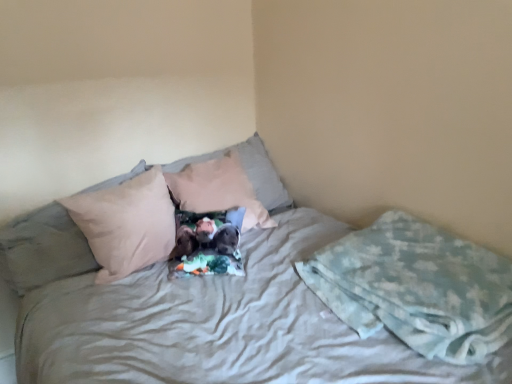
Question: Is beige fabric pillow at left, which appears as the first pillow when viewed from the left, outside of beige fabric pillow at center, which is counted as the second pillow, starting from the left?

Choices:
 (A) yes
 (B) no

Answer: (A)

Question: Could you tell me if beige fabric pillow at left, which appears as the first pillow when viewed from the left, is facing beige fabric pillow at center, which is counted as the second pillow, starting from the left?

Choices:
 (A) yes
 (B) no

Answer: (A)

Question: Is beige fabric pillow at left, which appears as the 3th pillow when viewed from the right, next to beige fabric pillow at center, which is counted as the second pillow, starting from the left?

Choices:
 (A) yes
 (B) no

Answer: (A)

Question: Is beige fabric pillow at left, which appears as the 3th pillow when viewed from the right, at the left side of beige fabric pillow at center, placed as the second pillow when sorted from right to left?

Choices:
 (A) yes
 (B) no

Answer: (A)

Question: Considering the relative sizes of beige fabric pillow at left, which appears as the first pillow when viewed from the left, and beige fabric pillow at center, which is counted as the second pillow, starting from the left, in the image provided, is beige fabric pillow at left, which appears as the first pillow when viewed from the left, taller than beige fabric pillow at center, which is counted as the second pillow, starting from the left,?

Choices:
 (A) yes
 (B) no

Answer: (B)

Question: Is beige fabric pillow at left, which appears as the first pillow when viewed from the left, positioned in front of beige fabric pillow at center, which is counted as the second pillow, starting from the left?

Choices:
 (A) no
 (B) yes

Answer: (A)

Question: From the image's perspective, is light brown fabric pillow at center, acting as the 3th pillow starting from the left, above beige fabric pillow at center, placed as the second pillow when sorted from right to left?

Choices:
 (A) no
 (B) yes

Answer: (B)

Question: Is light brown fabric pillow at center, acting as the 3th pillow starting from the left, behind beige fabric pillow at center, placed as the second pillow when sorted from right to left?

Choices:
 (A) yes
 (B) no

Answer: (A)

Question: Is light brown fabric pillow at center, arranged as the 1th pillow when viewed from the right, turned away from beige fabric pillow at center, which is counted as the second pillow, starting from the left?

Choices:
 (A) no
 (B) yes

Answer: (B)

Question: Considering the relative sizes of light brown fabric pillow at center, arranged as the 1th pillow when viewed from the right, and beige fabric pillow at center, placed as the second pillow when sorted from right to left, in the image provided, is light brown fabric pillow at center, arranged as the 1th pillow when viewed from the right, taller than beige fabric pillow at center, placed as the second pillow when sorted from right to left,?

Choices:
 (A) no
 (B) yes

Answer: (A)

Question: Does light brown fabric pillow at center, arranged as the 1th pillow when viewed from the right, have a lesser width compared to beige fabric pillow at center, which is counted as the second pillow, starting from the left?

Choices:
 (A) yes
 (B) no

Answer: (B)

Question: From the image's perspective, would you say light brown fabric pillow at center, arranged as the 1th pillow when viewed from the right, is shown under beige fabric pillow at center, which is counted as the second pillow, starting from the left?

Choices:
 (A) no
 (B) yes

Answer: (A)

Question: Are beige fabric pillow at center, placed as the second pillow when sorted from right to left, and light brown fabric pillow at center, acting as the 3th pillow starting from the left, located far from each other?

Choices:
 (A) yes
 (B) no

Answer: (B)